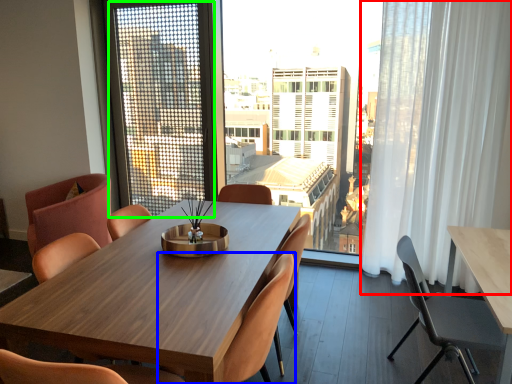
Question: Which is nearer to the curtain (highlighted by a red box)? chair (highlighted by a blue box) or screen door (highlighted by a green box).

Choices:
 (A) chair
 (B) screen door

Answer: (A)